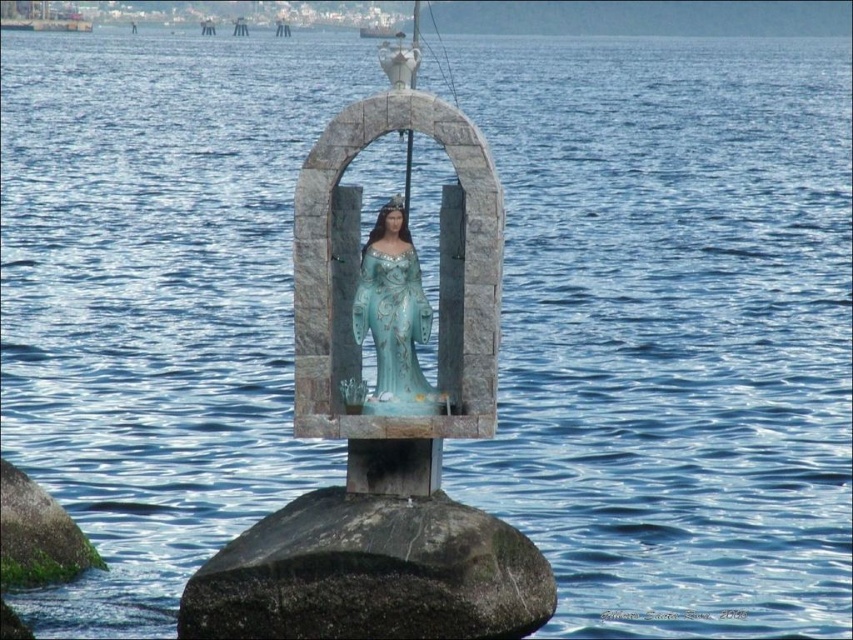
Measure the distance between blue glossy statue at center and turquoise glossy statue at center.

blue glossy statue at center and turquoise glossy statue at center are 5.35 meters apart from each other.

Is point (407, 545) positioned behind point (421, 305)?

No, it is in front of (421, 305).

Is point (241, 592) positioned behind point (415, 404)?

That is False.

The image size is (853, 640). Find the location of `blue glossy statue at center`. blue glossy statue at center is located at coordinates (386, 412).

Between dark gray stone at center and green mossy rock at lower left, which one is positioned higher?

dark gray stone at center is above.

Does point (224, 556) lie in front of point (51, 577)?

Yes, point (224, 556) is closer to viewer.

Is point (320, 518) closer to viewer compared to point (70, 534)?

That is True.

Find the location of a particular element. Image resolution: width=853 pixels, height=640 pixels. dark gray stone at center is located at coordinates 370,573.

Does blue glossy statue at center appear under dark gray stone at center?

No, blue glossy statue at center is not below dark gray stone at center.

Between point (312, 243) and point (386, 608), which one is positioned in front?

Point (386, 608)

This screenshot has width=853, height=640. Describe the element at coordinates (386, 412) in the screenshot. I see `blue glossy statue at center` at that location.

Find the location of a particular element. This screenshot has height=640, width=853. blue glossy statue at center is located at coordinates (386, 412).